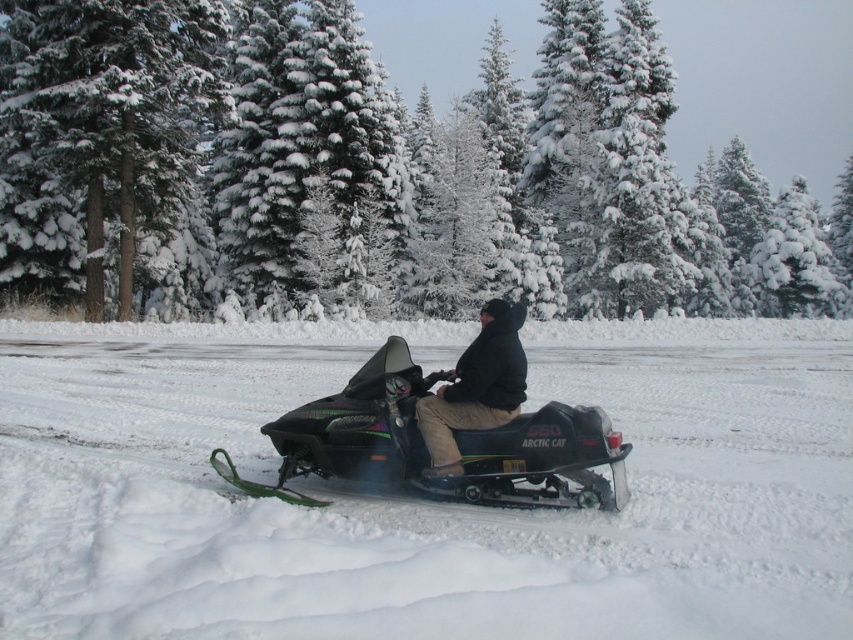
Is white fluffy snow at center positioned behind black matte snowmobile at center?

No, white fluffy snow at center is closer to the viewer.

Can you confirm if white fluffy snow at center is wider than black matte snowmobile at center?

Yes, white fluffy snow at center is wider than black matte snowmobile at center.

Image resolution: width=853 pixels, height=640 pixels. Find the location of `white fluffy snow at center`. white fluffy snow at center is located at coordinates (416, 499).

Where is `white fluffy snow at center`? This screenshot has width=853, height=640. white fluffy snow at center is located at coordinates (416, 499).

Does green textured pine tree at center lie in front of black matte snowmobile at center?

No, it is not.

Between green textured pine tree at center and black matte snowmobile at center, which one appears on the right side from the viewer's perspective?

Positioned to the right is green textured pine tree at center.

The width and height of the screenshot is (853, 640). What are the coordinates of `green textured pine tree at center` in the screenshot? It's located at (762, 83).

At what (x,y) coordinates should I click in order to perform the action: click on green textured pine tree at center. Please return your answer as a coordinate pair (x, y). Looking at the image, I should click on (762, 83).

Based on the photo, does black matte snowmobile at center appear over black matte jacket at center?

Actually, black matte snowmobile at center is below black matte jacket at center.

Is point (579, 410) positioned behind point (463, 385)?

No, (579, 410) is closer to viewer.

Is point (354, 429) behind point (428, 474)?

Yes, point (354, 429) is behind point (428, 474).

Identify the location of black matte snowmobile at center. (454, 442).